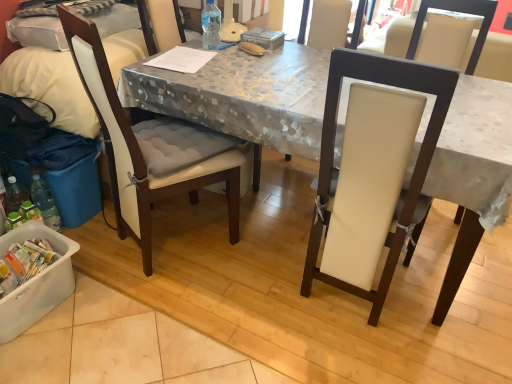
Question: Can you confirm if white fabric-covered desk at center is bigger than white padded chair at left, the first chair from the left?

Choices:
 (A) no
 (B) yes

Answer: (B)

Question: Is the position of white fabric-covered desk at center less distant than that of white padded chair at left, the 2th chair positioned from the right?

Choices:
 (A) no
 (B) yes

Answer: (B)

Question: Is white fabric-covered desk at center thinner than white padded chair at left, the 2th chair positioned from the right?

Choices:
 (A) yes
 (B) no

Answer: (B)

Question: Considering the relative sizes of white fabric-covered desk at center and white padded chair at left, the 2th chair positioned from the right, in the image provided, is white fabric-covered desk at center wider than white padded chair at left, the 2th chair positioned from the right,?

Choices:
 (A) yes
 (B) no

Answer: (A)

Question: Considering the relative positions of white fabric-covered desk at center and white padded chair at left, the 2th chair positioned from the right, in the image provided, is white fabric-covered desk at center to the right of white padded chair at left, the 2th chair positioned from the right, from the viewer's perspective?

Choices:
 (A) no
 (B) yes

Answer: (B)

Question: From the image's perspective, is white fabric-covered desk at center located above or below white plastic container at lower left?

Choices:
 (A) above
 (B) below

Answer: (A)

Question: Do you think white fabric-covered desk at center is within white plastic container at lower left, or outside of it?

Choices:
 (A) outside
 (B) inside

Answer: (A)

Question: In terms of height, does white fabric-covered desk at center look taller or shorter compared to white plastic container at lower left?

Choices:
 (A) short
 (B) tall

Answer: (B)

Question: In terms of size, does white fabric-covered desk at center appear bigger or smaller than white plastic container at lower left?

Choices:
 (A) small
 (B) big

Answer: (B)

Question: From a real-world perspective, is white padded chair at left, the first chair from the left, positioned above or below white plastic container at lower left?

Choices:
 (A) below
 (B) above

Answer: (B)

Question: From the image's perspective, is white padded chair at left, the first chair from the left, above or below white plastic container at lower left?

Choices:
 (A) above
 (B) below

Answer: (A)

Question: Would you say white padded chair at left, the first chair from the left, is inside or outside white plastic container at lower left?

Choices:
 (A) outside
 (B) inside

Answer: (A)

Question: Is point click(82, 61) positioned closer to the camera than point click(3, 311)?

Choices:
 (A) closer
 (B) farther

Answer: (A)

Question: Is white fabric-covered desk at center bigger or smaller than transparent plastic bottle at table center?

Choices:
 (A) big
 (B) small

Answer: (A)

Question: In the image, is white fabric-covered desk at center on the left side or the right side of transparent plastic bottle at table center?

Choices:
 (A) right
 (B) left

Answer: (A)